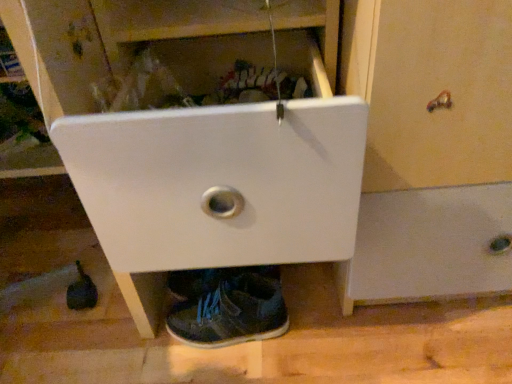
This screenshot has width=512, height=384. Find the location of `free space to the left of dark blue canvas shoe at lower center`. free space to the left of dark blue canvas shoe at lower center is located at coordinates (x=128, y=340).